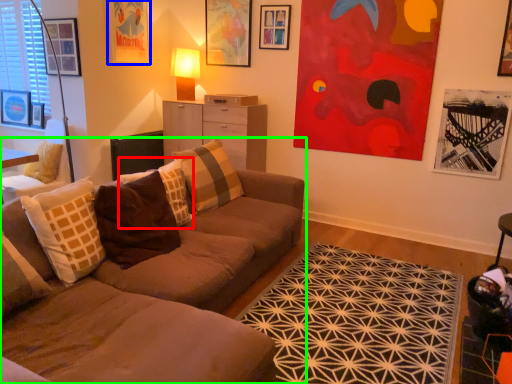
Question: Which object is the closest to the pillow (highlighted by a red box)? Choose among these: picture frame (highlighted by a blue box) or studio couch (highlighted by a green box).

Choices:
 (A) picture frame
 (B) studio couch

Answer: (B)